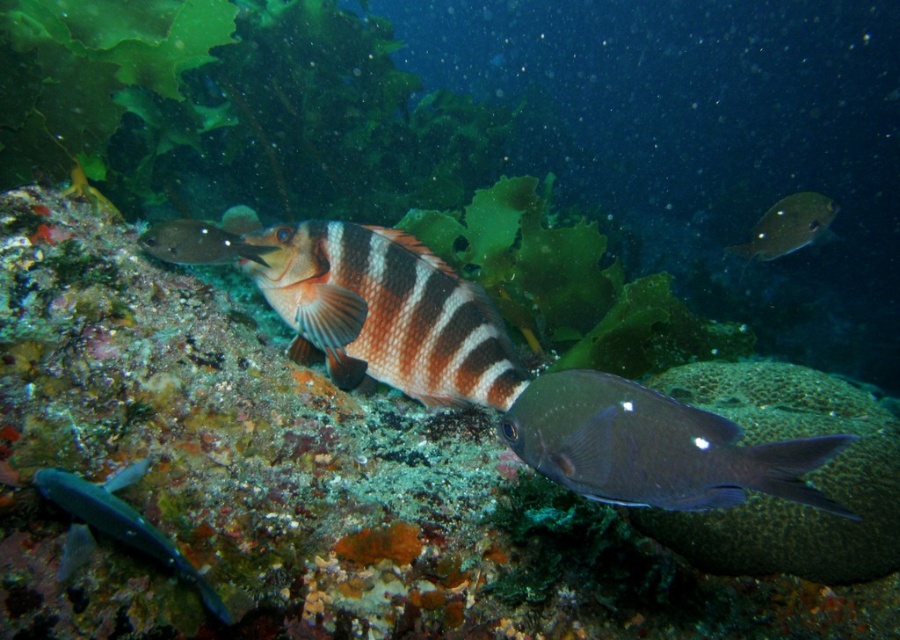
Who is positioned more to the left, shiny dark blue fish at center or shiny silver fish at upper right?

shiny dark blue fish at center is more to the left.

Is shiny dark blue fish at center bigger than shiny silver fish at upper right?

No, shiny dark blue fish at center is not bigger than shiny silver fish at upper right.

The height and width of the screenshot is (640, 900). I want to click on shiny dark blue fish at center, so click(x=653, y=448).

Does shiny blue fish at lower left appear on the left side of shiny silver fish at upper right?

Correct, you'll find shiny blue fish at lower left to the left of shiny silver fish at upper right.

You are a GUI agent. You are given a task and a screenshot of the screen. Output one action in this format:
    pyautogui.click(x=<x>, y=<y>)
    Task: Click on the shiny blue fish at lower left
    The height and width of the screenshot is (640, 900).
    Given the screenshot: What is the action you would take?
    pyautogui.click(x=115, y=525)

Is point (117, 500) positioned after point (767, 237)?

That is False.

Where is `shiny blue fish at lower left`? The width and height of the screenshot is (900, 640). shiny blue fish at lower left is located at coordinates (115, 525).

In the scene shown: Between shiny dark blue fish at center and shiny silver fish at upper left, which one has less height?

shiny silver fish at upper left is shorter.

Does shiny dark blue fish at center have a greater width compared to shiny silver fish at upper left?

No, shiny dark blue fish at center is not wider than shiny silver fish at upper left.

Does point (645, 484) come closer to viewer compared to point (218, 250)?

Yes, it is.

Find the location of a particular element. The width and height of the screenshot is (900, 640). shiny dark blue fish at center is located at coordinates (653, 448).